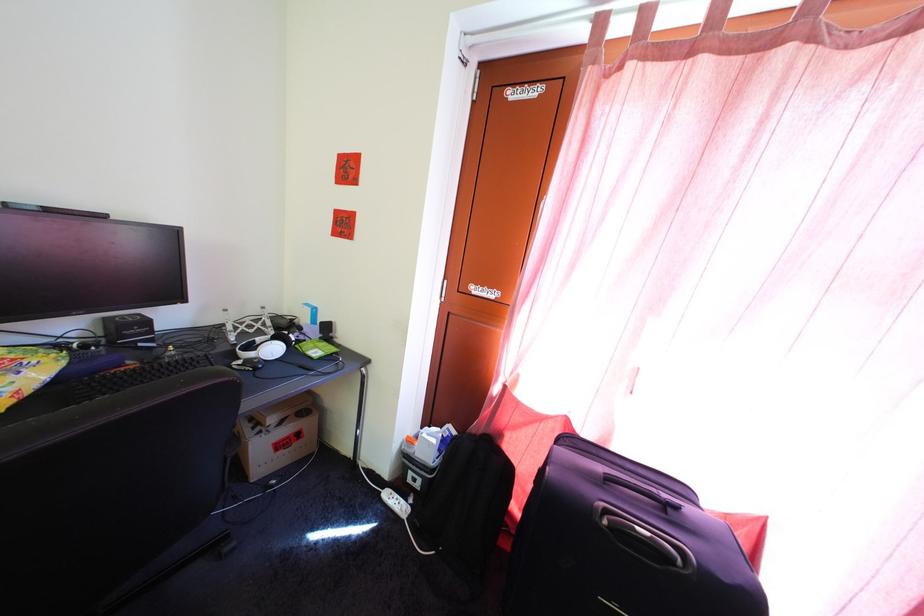
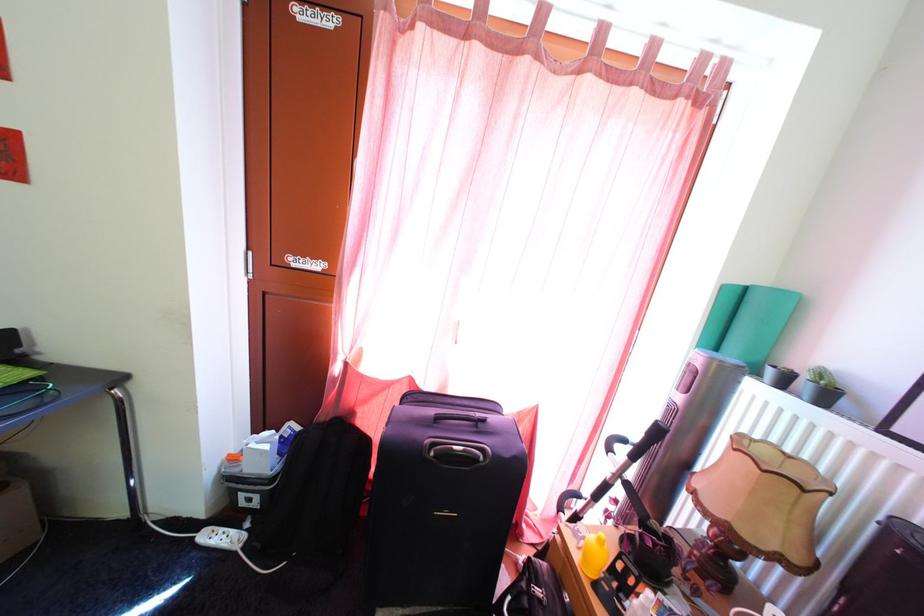
In the second image, find the point that corresponds to [393,493] in the first image.

(208, 533)